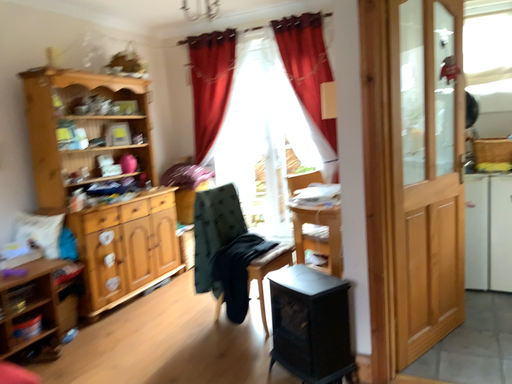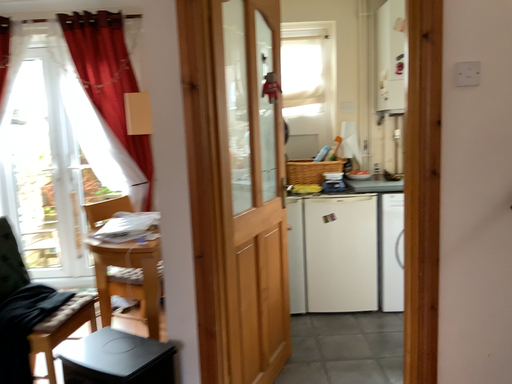
Question: How did the camera likely rotate when shooting the video?

Choices:
 (A) rotated right
 (B) rotated left

Answer: (A)